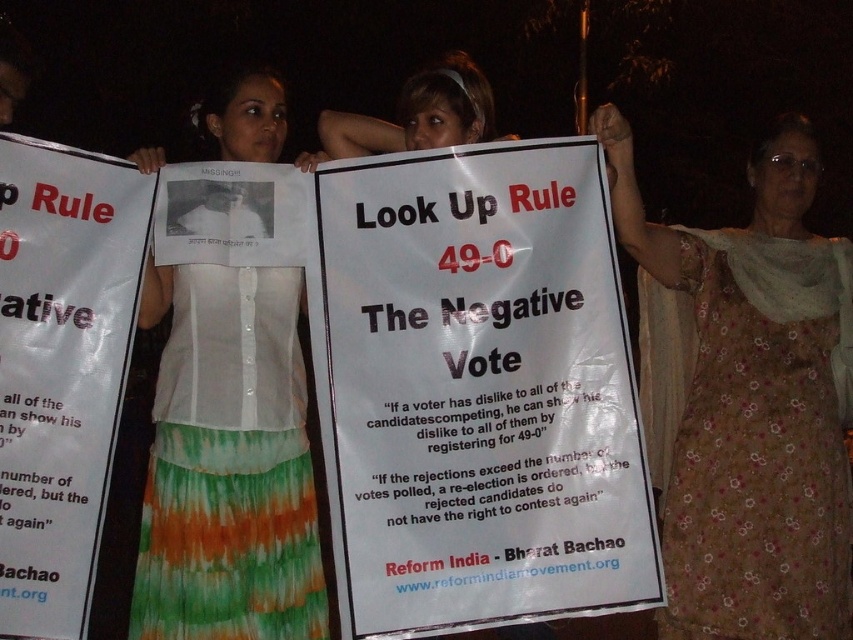
Does white paper poster at center have a larger size compared to white fabric shirt at center?

Correct, white paper poster at center is larger in size than white fabric shirt at center.

Is white paper poster at center wider than white fabric shirt at center?

Result: Indeed, white paper poster at center has a greater width compared to white fabric shirt at center.

Locate an element on the screen. white paper poster at center is located at coordinates (476, 392).

I want to click on white paper poster at center, so click(x=476, y=392).

Does white fabric shirt at center appear on the left side of white paper poster at left?

No, white fabric shirt at center is not to the left of white paper poster at left.

In the scene shown: Who is more forward, (184, 291) or (90, 276)?

Point (90, 276) is in front.

At what (x,y) coordinates should I click in order to perform the action: click on white fabric shirt at center. Please return your answer as a coordinate pair (x, y). Image resolution: width=853 pixels, height=640 pixels. Looking at the image, I should click on (228, 464).

From the picture: Is floral printed dress at center to the left of white paper poster at left from the viewer's perspective?

In fact, floral printed dress at center is to the right of white paper poster at left.

Does floral printed dress at center have a larger size compared to white paper poster at left?

Yes, floral printed dress at center is bigger than white paper poster at left.

Where is `floral printed dress at center`? floral printed dress at center is located at coordinates (746, 403).

This screenshot has width=853, height=640. I want to click on floral printed dress at center, so click(x=746, y=403).